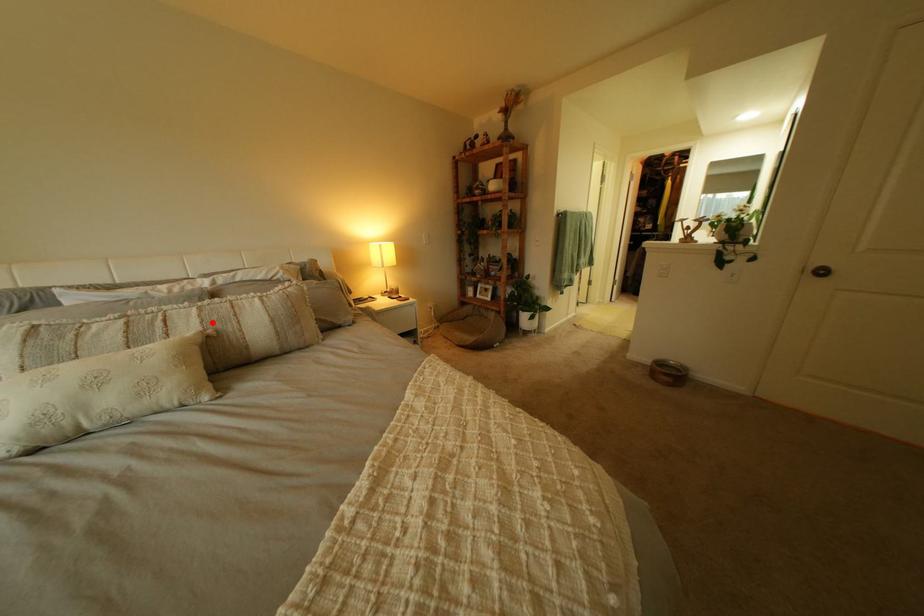
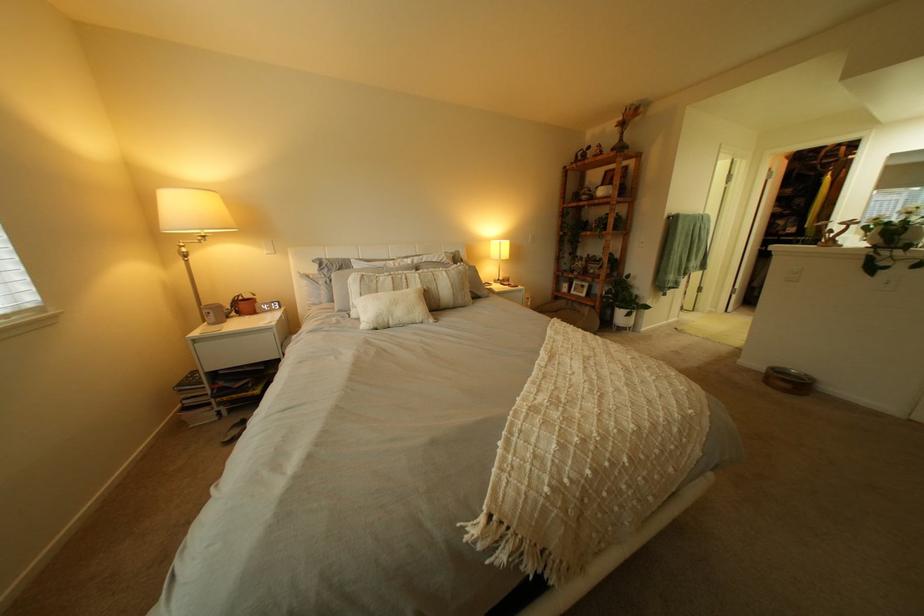
In the second image, find the point that corresponds to the highlighted location in the first image.

(434, 283)